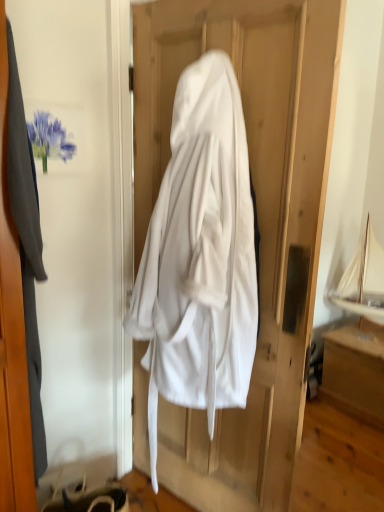
Question: Should I look upward or downward to see white fabric hanger at lower left?

Choices:
 (A) down
 (B) up

Answer: (A)

Question: Are white cloth at center and white fabric hanger at lower left far apart?

Choices:
 (A) no
 (B) yes

Answer: (A)

Question: Is white cloth at center oriented towards white fabric hanger at lower left?

Choices:
 (A) yes
 (B) no

Answer: (A)

Question: Is white cloth at center positioned before white fabric hanger at lower left?

Choices:
 (A) yes
 (B) no

Answer: (A)

Question: Considering the relative sizes of white cloth at center and white fabric hanger at lower left in the image provided, is white cloth at center bigger than white fabric hanger at lower left?

Choices:
 (A) no
 (B) yes

Answer: (B)

Question: Does white cloth at center come behind white fabric hanger at lower left?

Choices:
 (A) yes
 (B) no

Answer: (B)

Question: From a real-world perspective, is white cloth at center over white fabric hanger at lower left?

Choices:
 (A) no
 (B) yes

Answer: (B)

Question: Is matte gray coat at left positioned far away from wooden drawer at lower right?

Choices:
 (A) no
 (B) yes

Answer: (B)

Question: Does matte gray coat at left touch wooden drawer at lower right?

Choices:
 (A) yes
 (B) no

Answer: (B)

Question: Is matte gray coat at left outside of wooden drawer at lower right?

Choices:
 (A) yes
 (B) no

Answer: (A)

Question: Is matte gray coat at left behind wooden drawer at lower right?

Choices:
 (A) yes
 (B) no

Answer: (B)

Question: From a real-world perspective, is matte gray coat at left under wooden drawer at lower right?

Choices:
 (A) no
 (B) yes

Answer: (A)

Question: Can you confirm if matte gray coat at left is positioned to the right of wooden drawer at lower right?

Choices:
 (A) yes
 (B) no

Answer: (B)

Question: From the image's perspective, does white fabric hanger at lower left appear lower than white cloth at center?

Choices:
 (A) no
 (B) yes

Answer: (B)